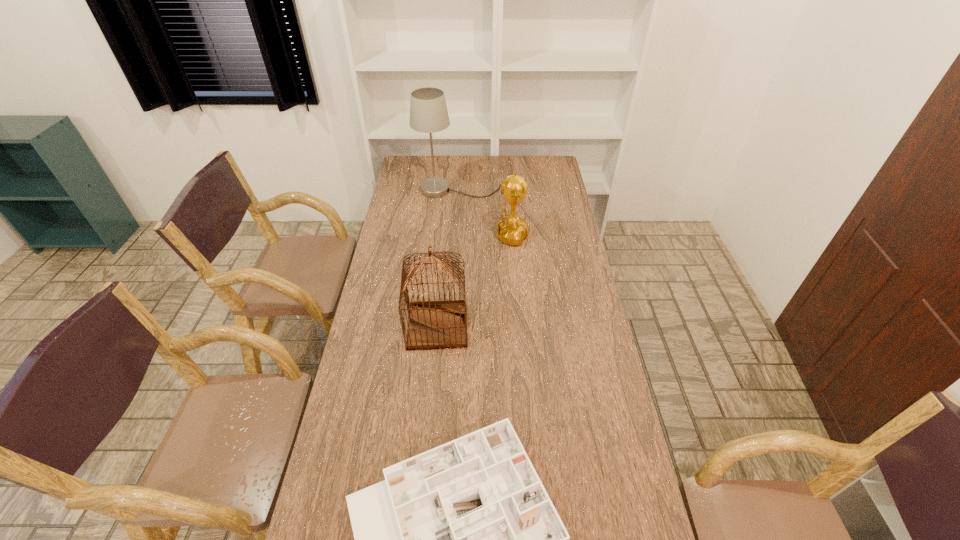
Identify which object is the closest to the nearest object. Please provide its 2D coordinates. Your answer should be formatted as a tuple, i.e. [(x, y)], where the tuple contains the x and y coordinates of a point satisfying the conditions above.

[(433, 325)]